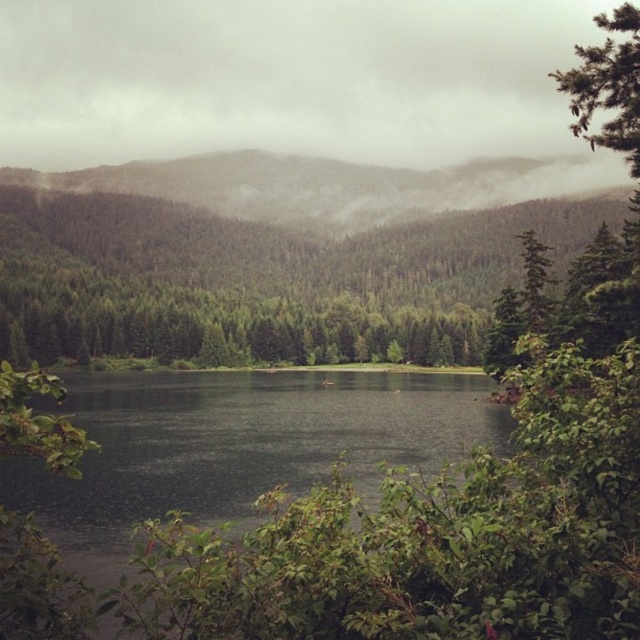
Which is above, green matte forest at center or green forested mountain at upper center?

green forested mountain at upper center is above.

Does green matte forest at center appear over green forested mountain at upper center?

No.

Is point (396, 280) in front of point (225, 202)?

Yes.

The height and width of the screenshot is (640, 640). What are the coordinates of `green matte forest at center` in the screenshot? It's located at (260, 280).